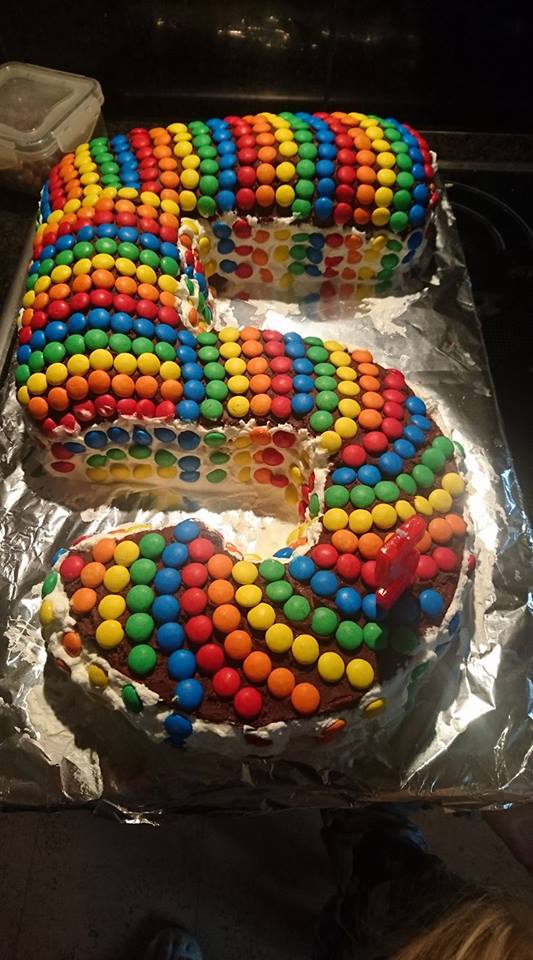
Find the location of a particular element. The height and width of the screenshot is (960, 533). glass container is located at coordinates (30, 168).